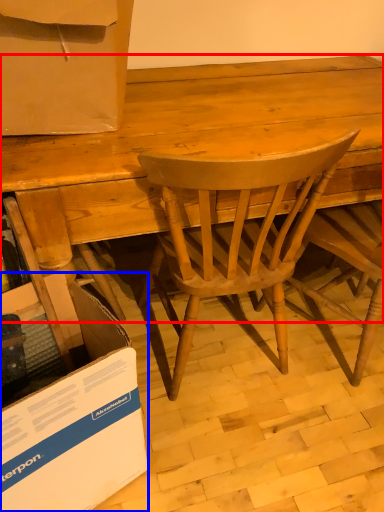
Question: Which of the following is the closest to the observer, desk (highlighted by a red box) or cardboard box (highlighted by a blue box)?

Choices:
 (A) desk
 (B) cardboard box

Answer: (B)